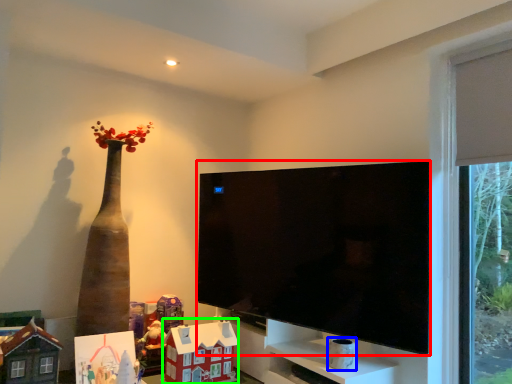
Question: Which object is positioned closest to television (highlighted by a red box)? Select from toy (highlighted by a blue box) and toy (highlighted by a green box).

Choices:
 (A) toy
 (B) toy

Answer: (B)